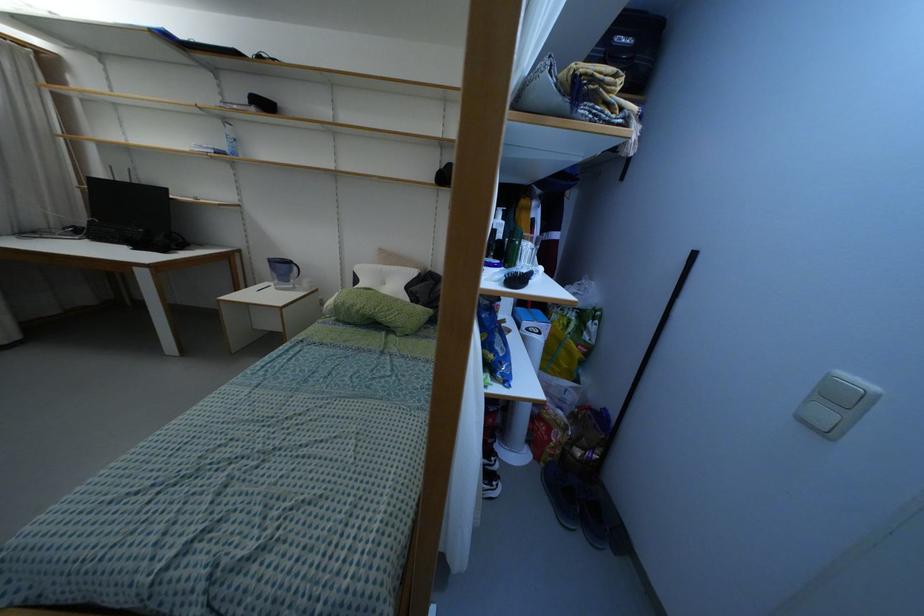
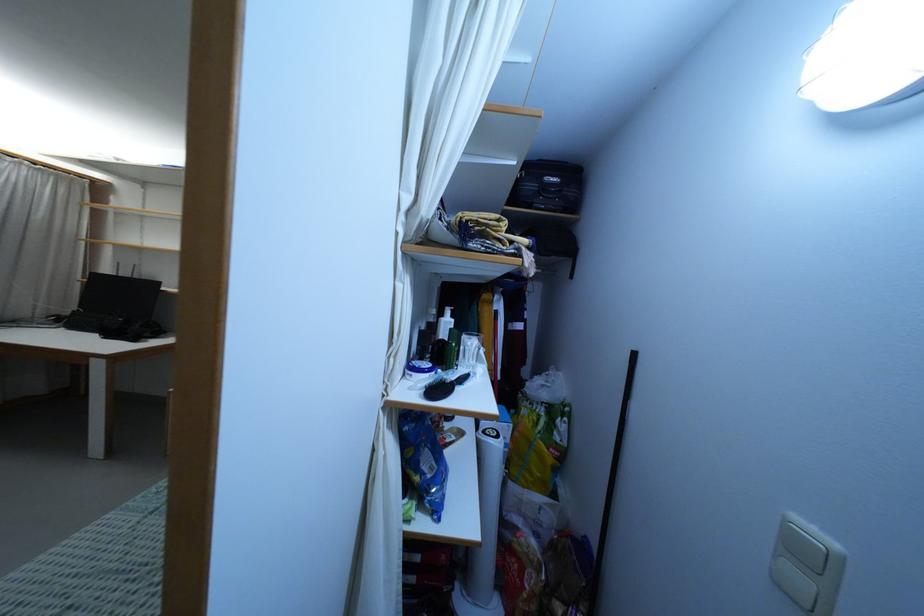
Where in the second image is the point corresponding to point 495,353 from the first image?

(422, 474)